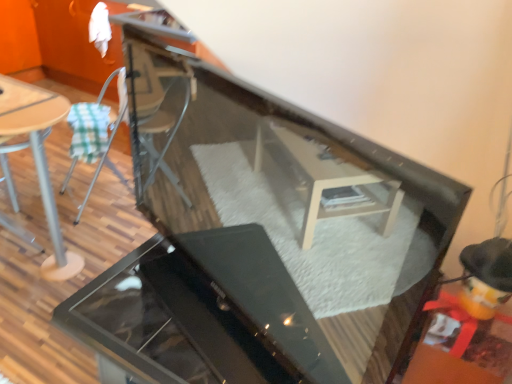
Question: Is the position of metallic silver chair at left more distant than that of glossy black grill at center?

Choices:
 (A) yes
 (B) no

Answer: (A)

Question: Is metallic silver chair at left located outside glossy black grill at center?

Choices:
 (A) yes
 (B) no

Answer: (A)

Question: Does metallic silver chair at left have a smaller size compared to glossy black grill at center?

Choices:
 (A) yes
 (B) no

Answer: (A)

Question: Is metallic silver chair at left in contact with glossy black grill at center?

Choices:
 (A) no
 (B) yes

Answer: (A)

Question: Is metallic silver chair at left far from glossy black grill at center?

Choices:
 (A) yes
 (B) no

Answer: (A)

Question: From the image's perspective, is metallic silver chair at left under glossy black grill at center?

Choices:
 (A) no
 (B) yes

Answer: (A)

Question: From the image's perspective, would you say wooden table top at left is shown under metallic silver chair at left?

Choices:
 (A) yes
 (B) no

Answer: (B)

Question: Is wooden table top at left far from metallic silver chair at left?

Choices:
 (A) yes
 (B) no

Answer: (B)

Question: Is wooden table top at left smaller than metallic silver chair at left?

Choices:
 (A) yes
 (B) no

Answer: (A)

Question: Is wooden table top at left wider than metallic silver chair at left?

Choices:
 (A) yes
 (B) no

Answer: (B)

Question: Is wooden table top at left looking in the opposite direction of metallic silver chair at left?

Choices:
 (A) yes
 (B) no

Answer: (A)

Question: From a real-world perspective, is wooden table top at left on top of metallic silver chair at left?

Choices:
 (A) no
 (B) yes

Answer: (B)

Question: Considering the relative sizes of wooden table at left and metallic silver chair at left in the image provided, is wooden table at left shorter than metallic silver chair at left?

Choices:
 (A) yes
 (B) no

Answer: (A)